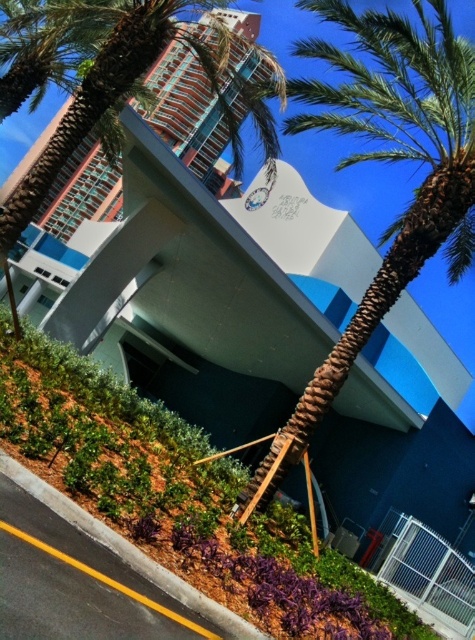
Question: Which object appears closest to the camera in this image?

Choices:
 (A) brown textured palm tree at center
 (B) green leafy palm tree at center

Answer: (A)

Question: Is brown textured palm tree at center closer to camera compared to green leafy palm tree at center?

Choices:
 (A) yes
 (B) no

Answer: (A)

Question: Observing the image, what is the correct spatial positioning of brown textured palm tree at center in reference to green leafy palm tree at center?

Choices:
 (A) right
 (B) left

Answer: (A)

Question: Does brown textured palm tree at center appear on the right side of green leafy palm tree at center?

Choices:
 (A) no
 (B) yes

Answer: (B)

Question: Which object is farther from the camera taking this photo?

Choices:
 (A) green leafy palm tree at center
 (B) brown textured palm tree at center

Answer: (A)

Question: Which point is closer to the camera taking this photo?

Choices:
 (A) (123, 17)
 (B) (462, 262)

Answer: (A)